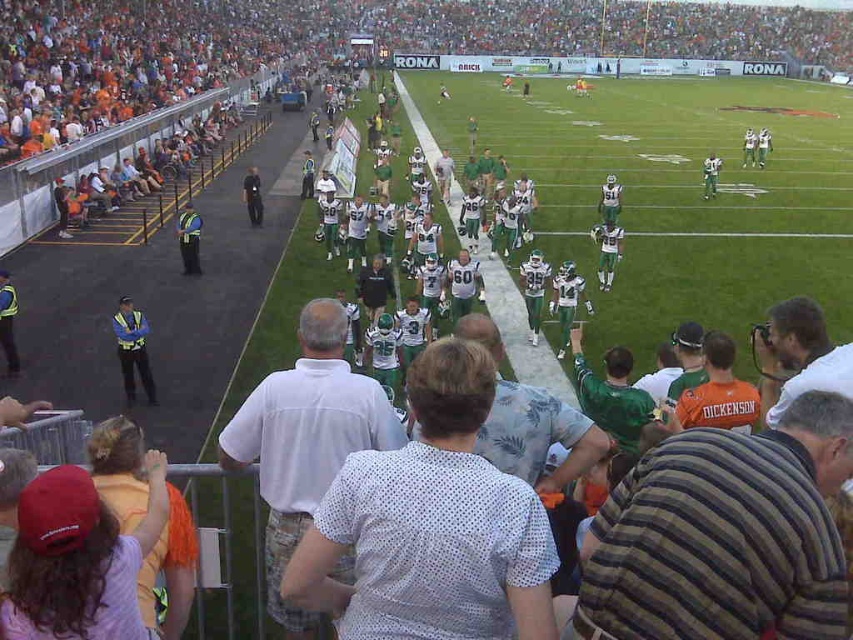
Question: Is reflective yellow vest at left to the right of reflective yellow vest at center from the viewer's perspective?

Choices:
 (A) no
 (B) yes

Answer: (B)

Question: Which of the following is the farthest from the observer?

Choices:
 (A) (709, 179)
 (B) (183, 266)

Answer: (A)

Question: Which point is farther to the camera?

Choices:
 (A) white jersey at center
 (B) reflective yellow vest at center
 (C) reflective yellow vest at left

Answer: (A)

Question: Is reflective yellow vest at left to the right of reflective yellow vest at center from the viewer's perspective?

Choices:
 (A) yes
 (B) no

Answer: (A)

Question: Which object is the farthest from the reflective yellow vest at center?

Choices:
 (A) white jersey at center
 (B) reflective yellow vest at left

Answer: (A)

Question: Can you confirm if reflective yellow vest at left is bigger than white jersey at center?

Choices:
 (A) no
 (B) yes

Answer: (A)